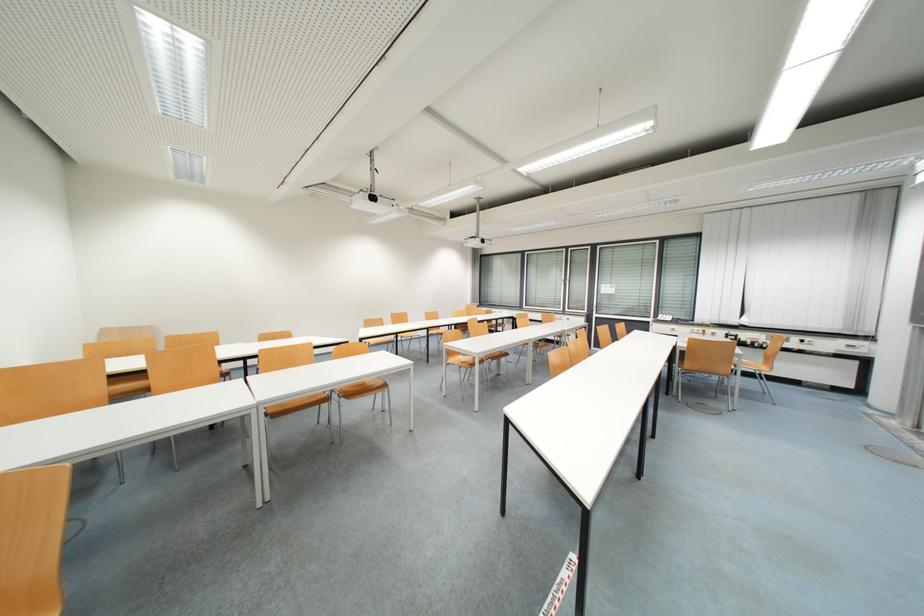
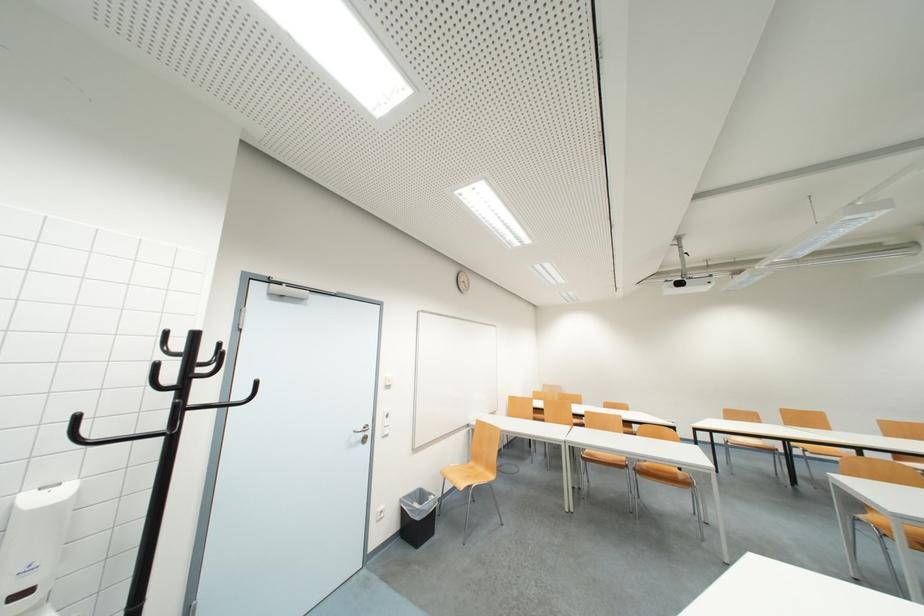
In the second image, find the point that corresponds to (373,323) in the first image.

(736, 416)